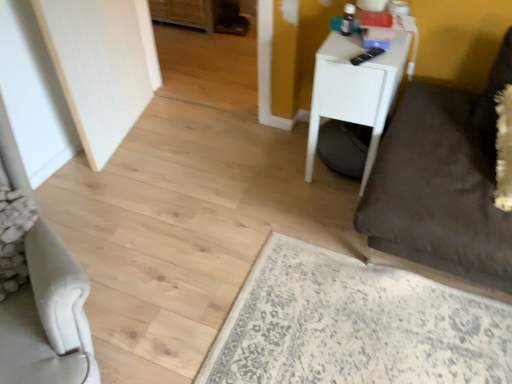
The width and height of the screenshot is (512, 384). I want to click on blank space to the left of white glossy table at upper right, so click(270, 164).